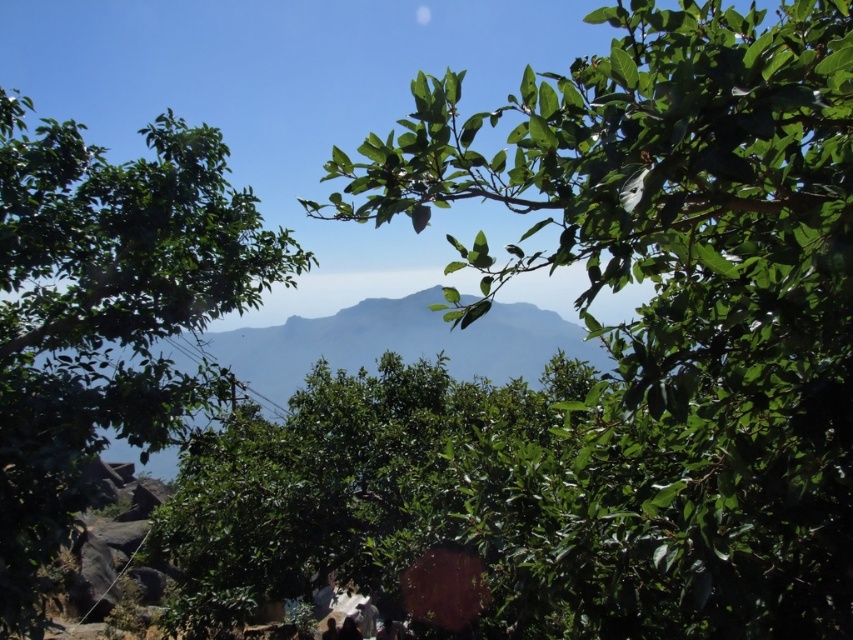
You are an artist trying to paint the scene. You notice two green leafy elements in the image. Which one is smaller between the green leafy branch at upper center and the green leafy tree at left?

The green leafy branch at upper center is smaller than the green leafy tree at left.

You are an artist trying to paint the scene. You need to place the green leafy branch at upper center in your canvas. Where exactly should you place it?

The green leafy branch at upper center should be placed at point 0.472 on the x axis and 0.798 on the y axis.

In the serene natural landscape, you notice two elements in the scene described as the green leafy branch at upper center and the green leafy tree at left. From your vantage point, which of these two is located to the right of the other?

The green leafy branch at upper center is positioned on the right side of the green leafy tree at left.